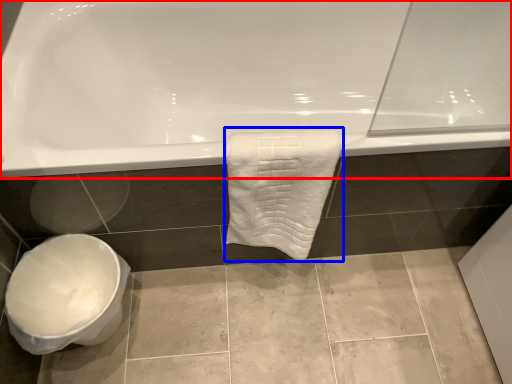
Question: Which object is further to the camera taking this photo, bathtub (highlighted by a red box) or towel (highlighted by a blue box)?

Choices:
 (A) bathtub
 (B) towel

Answer: (A)